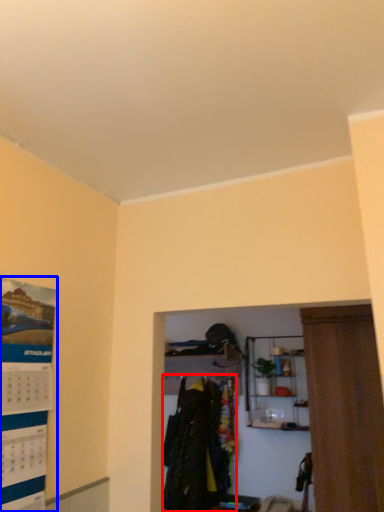
Question: Which point is closer to the camera, clothing (highlighted by a red box) or poster page (highlighted by a blue box)?

Choices:
 (A) clothing
 (B) poster page

Answer: (B)